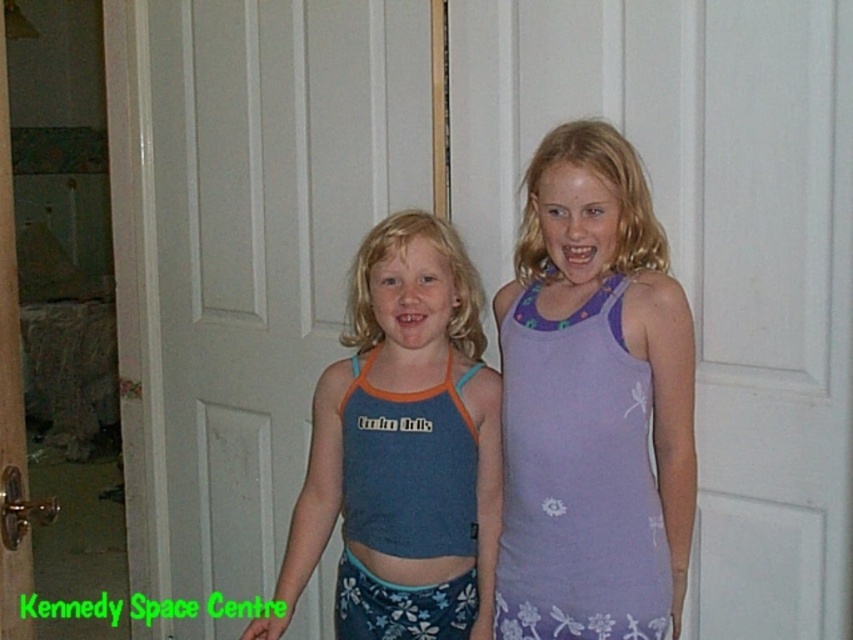
Question: Is white matte door at center wider than purple fabric tank top at center?

Choices:
 (A) no
 (B) yes

Answer: (B)

Question: Which is farther from the white matte door at center?

Choices:
 (A) purple fabric tank top at center
 (B) blue fabric tank top at center

Answer: (A)

Question: Is white matte door at center wider than purple fabric tank top at center?

Choices:
 (A) yes
 (B) no

Answer: (A)

Question: Which object appears closest to the camera in this image?

Choices:
 (A) purple fabric tank top at center
 (B) white matte door at center
 (C) blue fabric tank top at center

Answer: (A)

Question: Which point appears farthest from the camera in this image?

Choices:
 (A) (222, 396)
 (B) (677, 596)

Answer: (A)

Question: Can you confirm if white matte door at center is smaller than blue fabric tank top at center?

Choices:
 (A) yes
 (B) no

Answer: (B)